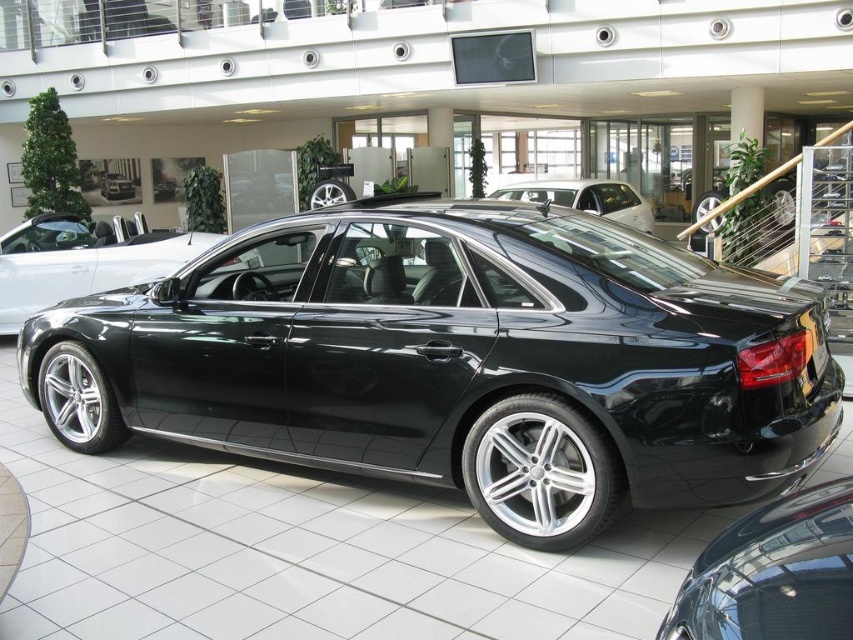
Does glossy black sedan at center have a larger size compared to matte black car at center?

Actually, glossy black sedan at center might be smaller than matte black car at center.

Is point (70, 236) positioned behind point (637, 227)?

No.

Locate an element on the screen. The height and width of the screenshot is (640, 853). glossy black sedan at center is located at coordinates pos(82,260).

In the scene shown: Can you confirm if shiny black sedan at center is shorter than glossy black sedan at center?

In fact, shiny black sedan at center may be taller than glossy black sedan at center.

Is shiny black sedan at center smaller than glossy black sedan at center?

No, shiny black sedan at center is not smaller than glossy black sedan at center.

Where is `shiny black sedan at center`? The image size is (853, 640). shiny black sedan at center is located at coordinates (459, 360).

In order to click on shiny black sedan at center in this screenshot , I will do `click(459, 360)`.

Is point (697, 604) less distant than point (131, 282)?

Yes, point (697, 604) is closer to viewer.

Between point (756, 528) and point (7, 284), which one is positioned in front?

Point (756, 528) is in front.

The image size is (853, 640). What are the coordinates of `glossy black car at center` in the screenshot? It's located at (773, 573).